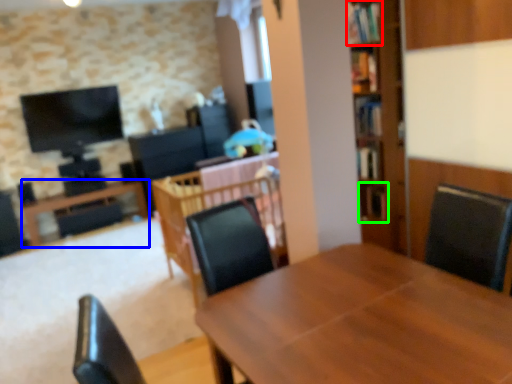
Question: Which object is positioned closest to shelf (highlighted by a red box)? Select from table (highlighted by a blue box) and shelf (highlighted by a green box).

Choices:
 (A) table
 (B) shelf

Answer: (B)